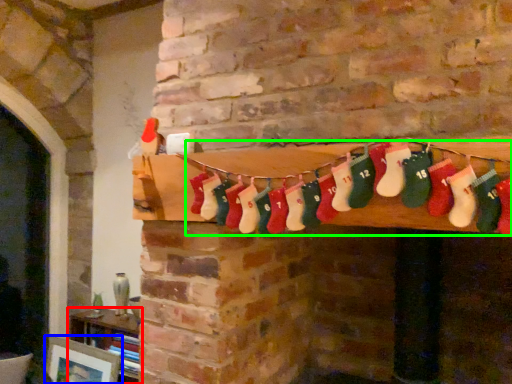
Question: Considering the real-world distances, which object is farthest from furniture (highlighted by a red box)? picture frame (highlighted by a blue box) or sock (highlighted by a green box)?

Choices:
 (A) picture frame
 (B) sock

Answer: (B)